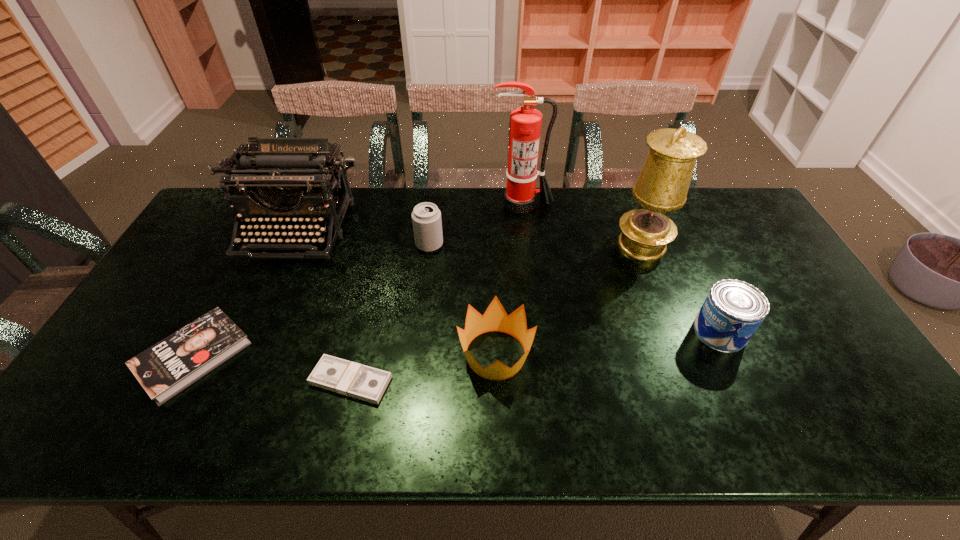
What are the coordinates of `fire extinguisher` in the screenshot? It's located at (520, 195).

Image resolution: width=960 pixels, height=540 pixels. In order to click on oil lamp in this screenshot , I will do (662, 186).

Locate an element on the screen. The width and height of the screenshot is (960, 540). the third tallest object is located at coordinates (286, 190).

Locate an element on the screen. This screenshot has width=960, height=540. the left can is located at coordinates (426, 217).

Where is `the farther can`? Image resolution: width=960 pixels, height=540 pixels. the farther can is located at coordinates (426, 217).

Where is `the right can`? the right can is located at coordinates (733, 310).

Find the location of a particular element. This screenshot has width=960, height=540. crown is located at coordinates (495, 318).

This screenshot has width=960, height=540. Identify the location of book. (165, 369).

The height and width of the screenshot is (540, 960). What are the coordinates of `the shortest object` in the screenshot? It's located at (345, 377).

Locate an element on the screen. This screenshot has width=960, height=540. free space located 0.390m at the nozzle of the fire extinguisher is located at coordinates (533, 296).